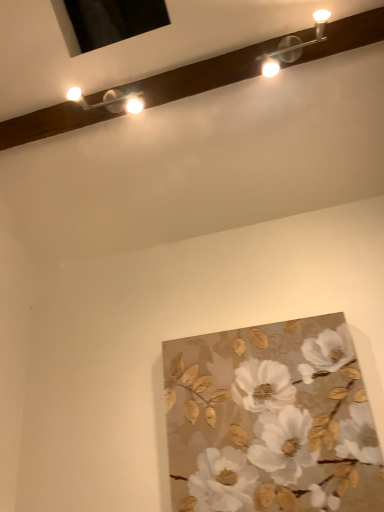
Question: Should I look upward or downward to see gold textured leaves and flowers at center?

Choices:
 (A) up
 (B) down

Answer: (B)